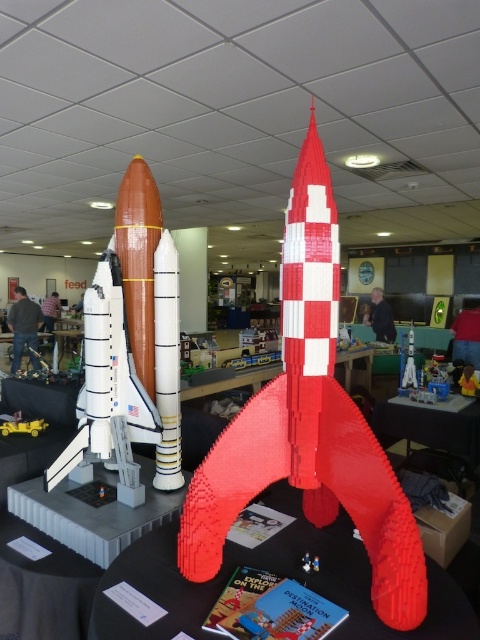
Question: Considering the real-world distances, which object is farthest from the red plastic table at center?

Choices:
 (A) red matte rocket at center
 (B) black plastic table at center
 (C) matte plastic rocket at center
 (D) matte white rocket at center

Answer: (C)

Question: Which is farther from the matte plastic rocket at center?

Choices:
 (A) red plastic table at center
 (B) yellow plastic toy car at center
 (C) black plastic table at center
 (D) red matte rocket at center

Answer: (D)

Question: Is the position of black plastic table at center more distant than that of yellow plastic toy car at center?

Choices:
 (A) no
 (B) yes

Answer: (B)

Question: Estimate the real-world distances between objects in this image. Which object is farther from the matte white rocket at center?

Choices:
 (A) red matte rocket at center
 (B) black plastic table at center
 (C) red plastic table at center
 (D) matte plastic rocket at center

Answer: (D)

Question: Is the position of red matte rocket at center more distant than that of matte plastic rocket at center?

Choices:
 (A) no
 (B) yes

Answer: (A)

Question: Can you confirm if red matte rocket at center is wider than black plastic table at center?

Choices:
 (A) no
 (B) yes

Answer: (A)